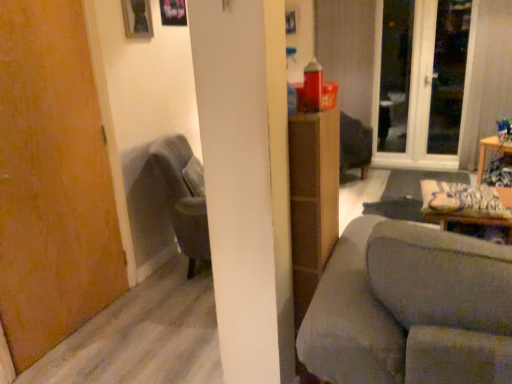
Describe the element at coordinates (312, 200) in the screenshot. I see `brown cardboard dresser at center` at that location.

The height and width of the screenshot is (384, 512). I want to click on white glass screen door at upper right, so pos(420,98).

Image resolution: width=512 pixels, height=384 pixels. What do you see at coordinates (52, 181) in the screenshot?
I see `wooden door at left` at bounding box center [52, 181].

Locate an element on the screen. The image size is (512, 384). gray fabric couch at center is located at coordinates (406, 306).

I want to click on velvet grey armchair at left, so click(x=184, y=196).

Between point (44, 308) and point (460, 327), which one is positioned in front?

The point (460, 327) is in front.

The height and width of the screenshot is (384, 512). I want to click on door positioned vertically above the gray fabric couch at center (from a real-world perspective), so click(52, 181).

Who is more distant, wooden door at left or gray fabric couch at center?

wooden door at left is further from the camera.

From the image's perspective, which object appears higher, white glass screen door at upper right or transparent glass window at upper right?

transparent glass window at upper right, from the image's perspective.

Looking at this image, is white glass screen door at upper right facing away from transparent glass window at upper right?

Absolutely, white glass screen door at upper right is directed away from transparent glass window at upper right.

Between point (378, 161) and point (399, 113), which one is positioned behind?

The point (399, 113) is behind.

From a real-world perspective, who is located higher, brown cardboard dresser at center or velvet grey armchair at left?

brown cardboard dresser at center is physically above.

How much distance is there between brown cardboard dresser at center and velvet grey armchair at left?

1.14 meters.

The width and height of the screenshot is (512, 384). I want to click on chair on the left of brown cardboard dresser at center, so click(184, 196).

Does point (302, 129) appear closer or farther from the camera than point (170, 216)?

Point (302, 129) is positioned closer to the camera compared to point (170, 216).

Is wooden table at right directly adjacent to brown cardboard dresser at center?

No, wooden table at right is not next to brown cardboard dresser at center.

Is wooden table at right facing towards brown cardboard dresser at center?

Yes, wooden table at right is oriented towards brown cardboard dresser at center.

Is wooden table at right to the right of brown cardboard dresser at center from the viewer's perspective?

Correct, you'll find wooden table at right to the right of brown cardboard dresser at center.

Is brown cardboard dresser at center located outside wooden door at left?

That's correct, brown cardboard dresser at center is outside of wooden door at left.

Locate an element on the screen. The height and width of the screenshot is (384, 512). door on the left of the brown cardboard dresser at center is located at coordinates [52, 181].

Which is in front, brown cardboard dresser at center or wooden door at left?

brown cardboard dresser at center is in front.

Is brown cardboard dresser at center beside gray fabric couch at center?

brown cardboard dresser at center and gray fabric couch at center are not in contact.

Is brown cardboard dresser at center turned away from gray fabric couch at center?

brown cardboard dresser at center is not turned away from gray fabric couch at center.

Consider the image. Which of these two, brown cardboard dresser at center or gray fabric couch at center, stands shorter?

Standing shorter between the two is gray fabric couch at center.

Considering the positions of objects brown cardboard dresser at center and gray fabric couch at center in the image provided, who is behind, brown cardboard dresser at center or gray fabric couch at center?

brown cardboard dresser at center is further away from the camera.

Does white glass screen door at upper right lie behind brown cardboard dresser at center?

Yes, white glass screen door at upper right is further from the camera.

From the image's perspective, is white glass screen door at upper right positioned above or below brown cardboard dresser at center?

Clearly, from the image's perspective, white glass screen door at upper right is above brown cardboard dresser at center.

Is white glass screen door at upper right far from brown cardboard dresser at center?

Yes.

Is white glass screen door at upper right positioned beyond the bounds of brown cardboard dresser at center?

Yes, white glass screen door at upper right is outside of brown cardboard dresser at center.

Locate an element on the screen. This screenshot has height=384, width=512. studio couch below the wooden door at left (from the image's perspective) is located at coordinates (406, 306).

Identify the location of window screen behind the white glass screen door at upper right. Image resolution: width=512 pixels, height=384 pixels. (395, 74).

Looking at this image, when comparing their distances from white glass screen door at upper right, does velvet grey armchair at left or wooden door at left seem further?

wooden door at left.

Estimate the real-world distances between objects in this image. Which object is further from wooden table at right, gray fabric couch at center or wooden door at left?

wooden door at left is further to wooden table at right.

Which object lies nearer to the anchor point brown cardboard dresser at center, velvet grey armchair at left or wooden door at left?

The object closer to brown cardboard dresser at center is velvet grey armchair at left.

When comparing their distances from wooden door at left, does brown cardboard dresser at center or velvet grey armchair at left seem further?

Based on the image, brown cardboard dresser at center appears to be further to wooden door at left.

From the image, which object appears to be farther from white glass screen door at upper right, gray fabric couch at center or wooden table at right?

gray fabric couch at center.

When comparing their distances from wooden door at left, does gray fabric couch at center or transparent glass window at upper right seem closer?

gray fabric couch at center lies closer to wooden door at left than the other object.

Estimate the real-world distances between objects in this image. Which object is closer to brown cardboard dresser at center, gray fabric couch at center or white glass screen door at upper right?

gray fabric couch at center.

Estimate the real-world distances between objects in this image. Which object is further from white glass screen door at upper right, transparent glass window at upper right or velvet grey armchair at left?

velvet grey armchair at left lies further to white glass screen door at upper right than the other object.

What are the coordinates of `window screen between velvet grey armchair at left and white glass screen door at upper right in the horizontal direction` in the screenshot? It's located at (395, 74).

This screenshot has height=384, width=512. What are the coordinates of `chair between brown cardboard dresser at center and white glass screen door at upper right along the z-axis` in the screenshot? It's located at (184, 196).

Identify the location of dresser positioned between gray fabric couch at center and transparent glass window at upper right from near to far. (312, 200).

Where is `table between brown cardboard dresser at center and transparent glass window at upper right from front to back`? The height and width of the screenshot is (384, 512). table between brown cardboard dresser at center and transparent glass window at upper right from front to back is located at coordinates (490, 150).